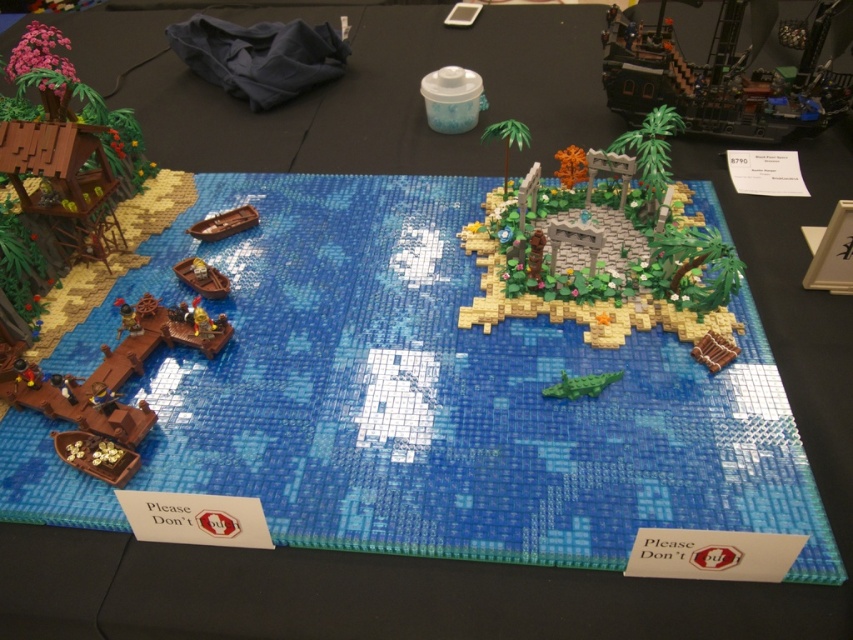
Question: Does smooth brown island at center have a greater width compared to green matte crocodile at center?

Choices:
 (A) no
 (B) yes

Answer: (B)

Question: Which of the following is the closest to the observer?

Choices:
 (A) 515,432
 (B) 247,205
 (C) 631,35

Answer: (A)

Question: Does green matte crocodile at center have a lesser width compared to brown matte boat at center-left?

Choices:
 (A) no
 (B) yes

Answer: (A)

Question: Which point is farther to the camera?

Choices:
 (A) green matte crocodile at center
 (B) blue mosaic tile at center
 (C) brown matte boat at center-left

Answer: (C)

Question: Which point is closer to the camera?

Choices:
 (A) brown matte boat at upper left
 (B) blue mosaic tile at center
 (C) brown matte boat at center-left

Answer: (B)

Question: In this image, where is dark brown wooden pirate ship at upper right located relative to brown matte boat at center-left?

Choices:
 (A) below
 (B) above

Answer: (B)